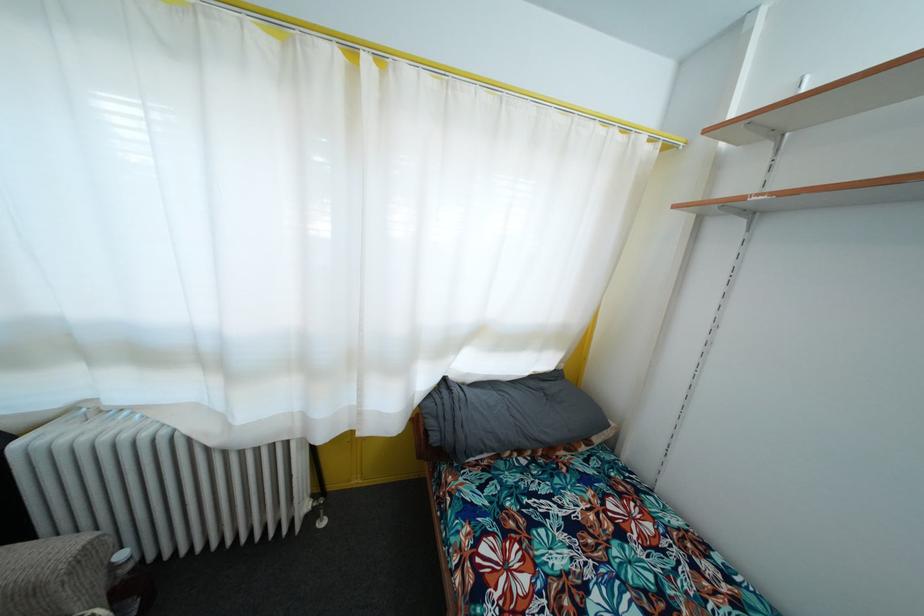
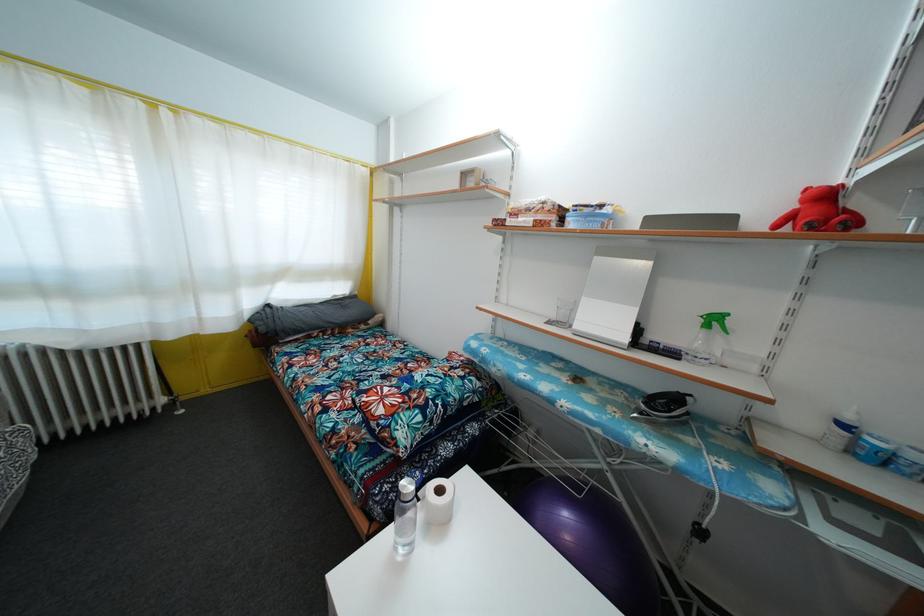
Where in the second image is the point corresponding to point 565,373 from the first image?

(359, 300)